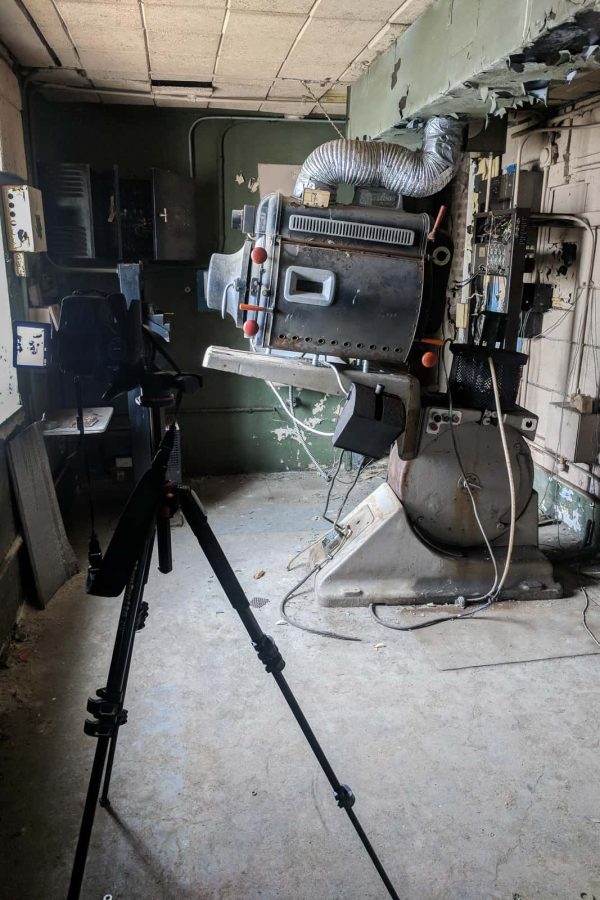
Locate an element on the screen. peeling paint is located at coordinates pos(537,85), pos(567,34).